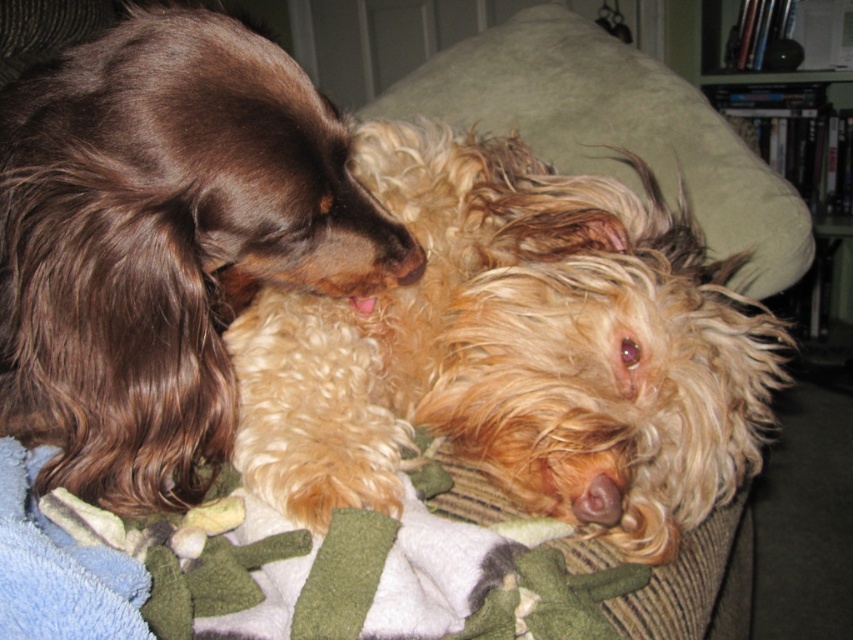
You are a dog owner who wants to place a new toy between the fuzzy golden dog at center and the green soft pillow at upper center. Based on their positions, where should you place the toy?

The fuzzy golden dog at center is below the green soft pillow at upper center, so you should place the toy between them in the space between the fuzzy golden dog at center and the green soft pillow at upper center.

You are trying to place a small toy on the surface between the fuzzy golden dog at center and the green soft pillow at upper center. Based on their sizes, will the toy be visible from above? Please explain.

The fuzzy golden dog at center has a lesser height compared to green soft pillow at upper center. Since the toy is placed between them, the green soft pillow at upper center might block the view of the toy if it is taller. However, since the fuzzy golden dog is shorter, the toy might still be visible from above depending on its placement between them.

Based on the scene described, where is the fuzzy golden dog at center located in relation to the wooden bookshelf at upper right?

The fuzzy golden dog at center is to the left of the wooden bookshelf at upper right.